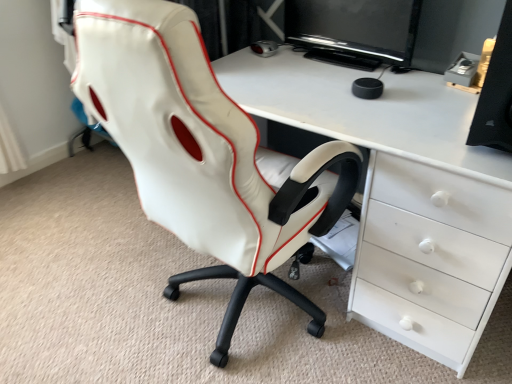
The height and width of the screenshot is (384, 512). Find the location of `vacant space underneath black glossy monitor at upper center (from a real-world perspective)`. vacant space underneath black glossy monitor at upper center (from a real-world perspective) is located at coordinates (356, 65).